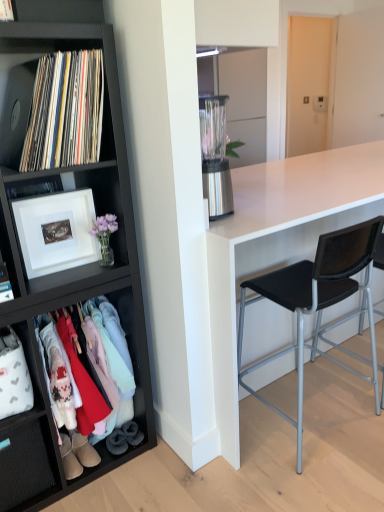
You are a GUI agent. You are given a task and a screenshot of the screen. Output one action in this format:
    pyautogui.click(x=<x>, y=<y>)
    Task: Click on the free spot in front of light brown suede boot at lower left, the second footwear when ordered from left to right
    This screenshot has height=512, width=384.
    Given the screenshot: What is the action you would take?
    pyautogui.click(x=74, y=490)